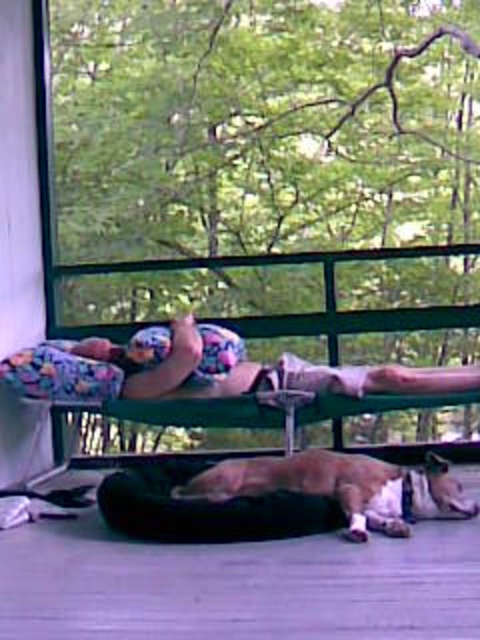
You are planning to take a nap in this room and want to ensure there is enough space for your body. You see the floral fabric person at center and the brown fur dog at lower center. Which one occupies more horizontal space in the room?

The floral fabric person at center might be wider than brown fur dog at lower center, so they take up more horizontal space.

You are a guest in this room and want to place a small plant pot on the floor next to the black fabric dog bed at lower center. Considering the space occupied by the brown fur dog at lower center, will there be enough room for the plant pot?

The black fabric dog bed at lower center is not as tall as the brown fur dog at lower center, but since the dog is lying on the bed, there should still be enough space on the floor next to the bed for the plant pot.